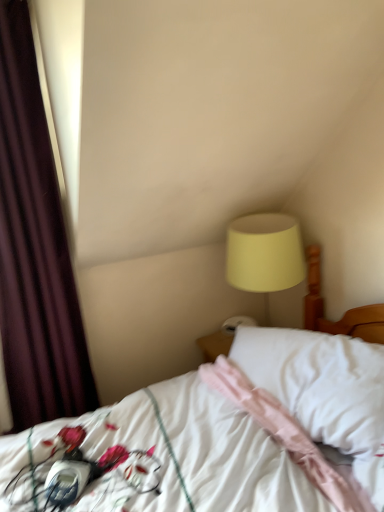
Question: Is matte yellow lampshade at upper right bigger than pink fabric pillow at center?

Choices:
 (A) no
 (B) yes

Answer: (B)

Question: Is matte yellow lampshade at upper right oriented towards pink fabric pillow at center?

Choices:
 (A) no
 (B) yes

Answer: (A)

Question: Is matte yellow lampshade at upper right positioned behind pink fabric pillow at center?

Choices:
 (A) no
 (B) yes

Answer: (B)

Question: Is matte yellow lampshade at upper right outside pink fabric pillow at center?

Choices:
 (A) no
 (B) yes

Answer: (B)

Question: From the image's perspective, would you say matte yellow lampshade at upper right is positioned over pink fabric pillow at center?

Choices:
 (A) no
 (B) yes

Answer: (B)

Question: From the image's perspective, is white satin bed at center above or below dark purple velvet curtain at left?

Choices:
 (A) below
 (B) above

Answer: (A)

Question: In the image, is white satin bed at center positioned in front of or behind dark purple velvet curtain at left?

Choices:
 (A) front
 (B) behind

Answer: (A)

Question: Is point [x=271, y=356] positioned closer to the camera than point [x=1, y=7]?

Choices:
 (A) closer
 (B) farther

Answer: (A)

Question: From a real-world perspective, is white satin bed at center physically located above or below dark purple velvet curtain at left?

Choices:
 (A) below
 (B) above

Answer: (A)

Question: Considering their positions, is pink fabric pillow at center located in front of or behind matte yellow lampshade at upper right?

Choices:
 (A) front
 (B) behind

Answer: (A)

Question: Is point (301, 386) positioned closer to the camera than point (289, 276)?

Choices:
 (A) closer
 (B) farther

Answer: (A)

Question: From their relative heights in the image, would you say pink fabric pillow at center is taller or shorter than matte yellow lampshade at upper right?

Choices:
 (A) short
 (B) tall

Answer: (A)

Question: Is pink fabric pillow at center bigger or smaller than matte yellow lampshade at upper right?

Choices:
 (A) small
 (B) big

Answer: (A)

Question: Considering the positions of pink fabric pillow at center and white satin bed at center in the image, is pink fabric pillow at center wider or thinner than white satin bed at center?

Choices:
 (A) wide
 (B) thin

Answer: (B)

Question: Which is correct: pink fabric pillow at center is inside white satin bed at center, or outside of it?

Choices:
 (A) outside
 (B) inside

Answer: (B)